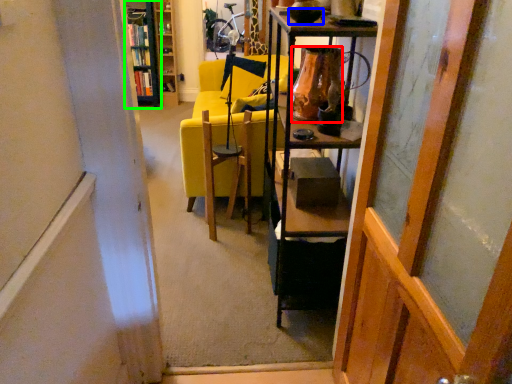
Question: Based on their relative distances, which object is nearer to vase (highlighted by a red box)? Choose from bowl (highlighted by a blue box) and cabinetry (highlighted by a green box).

Choices:
 (A) bowl
 (B) cabinetry

Answer: (A)